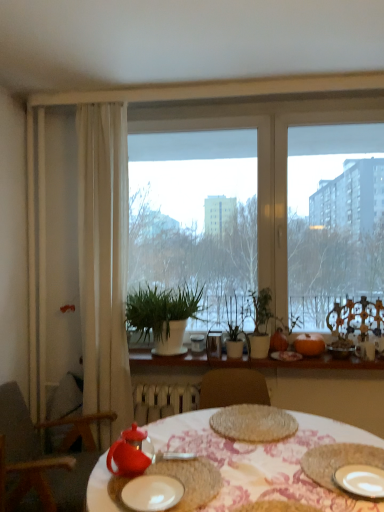
Where is `empty space that is to the right of matte red teapot at lower left`? empty space that is to the right of matte red teapot at lower left is located at coordinates (264, 475).